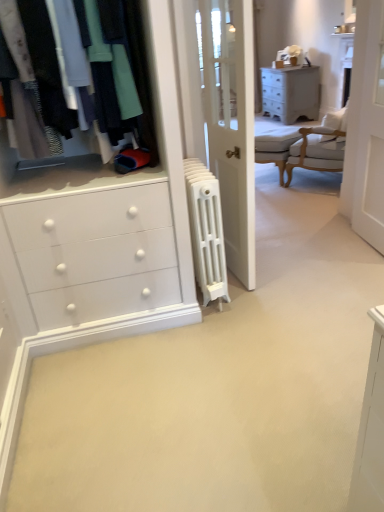
Question: Is matte black clothing at upper left oriented away from white wood screen door at upper right?

Choices:
 (A) no
 (B) yes

Answer: (A)

Question: Is matte black clothing at upper left outside of white wood screen door at upper right?

Choices:
 (A) yes
 (B) no

Answer: (A)

Question: Can you confirm if matte black clothing at upper left is taller than white wood screen door at upper right?

Choices:
 (A) no
 (B) yes

Answer: (A)

Question: Can you confirm if matte black clothing at upper left is thinner than white wood screen door at upper right?

Choices:
 (A) no
 (B) yes

Answer: (A)

Question: Is white wood screen door at upper right located within matte black clothing at upper left?

Choices:
 (A) yes
 (B) no

Answer: (B)

Question: Is light gray fabric armchair at center wider or thinner than matte gray chest of drawers at upper right?

Choices:
 (A) wide
 (B) thin

Answer: (B)

Question: Is light gray fabric armchair at center in front of or behind matte gray chest of drawers at upper right in the image?

Choices:
 (A) front
 (B) behind

Answer: (A)

Question: Is light gray fabric armchair at center spatially inside matte gray chest of drawers at upper right, or outside of it?

Choices:
 (A) inside
 (B) outside

Answer: (B)

Question: Is point (284, 130) closer or farther from the camera than point (314, 97)?

Choices:
 (A) closer
 (B) farther

Answer: (A)

Question: Is white upholstered chair at upper right bigger or smaller than white cast iron radiator at center?

Choices:
 (A) small
 (B) big

Answer: (B)

Question: Considering the positions of point (314, 143) and point (193, 161), is point (314, 143) closer or farther from the camera than point (193, 161)?

Choices:
 (A) closer
 (B) farther

Answer: (B)

Question: From the image's perspective, relative to white cast iron radiator at center, is white upholstered chair at upper right above or below?

Choices:
 (A) below
 (B) above

Answer: (B)

Question: Is white upholstered chair at upper right taller or shorter than white cast iron radiator at center?

Choices:
 (A) short
 (B) tall

Answer: (B)

Question: Based on their sizes in the image, would you say matte gray chest of drawers at upper right is bigger or smaller than white upholstered chair at upper right?

Choices:
 (A) big
 (B) small

Answer: (A)

Question: In terms of height, does matte gray chest of drawers at upper right look taller or shorter compared to white upholstered chair at upper right?

Choices:
 (A) tall
 (B) short

Answer: (B)